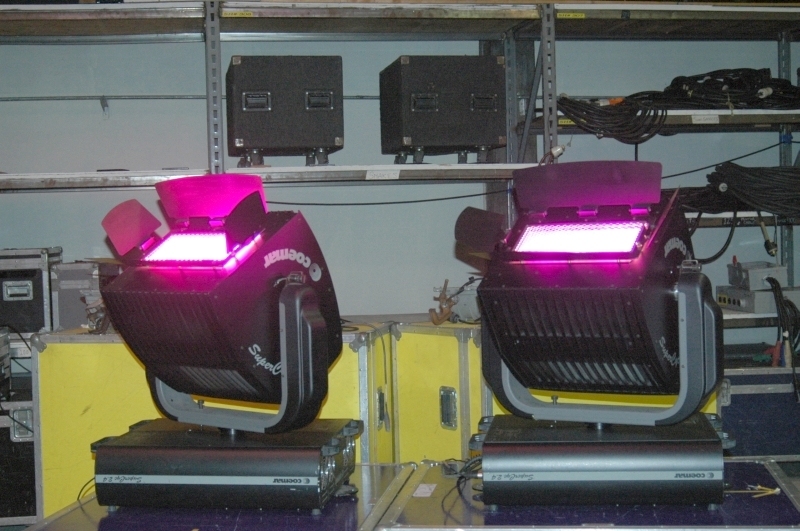
Locate an element on the screen. This screenshot has height=531, width=800. pink light is located at coordinates (189, 245), (566, 229).